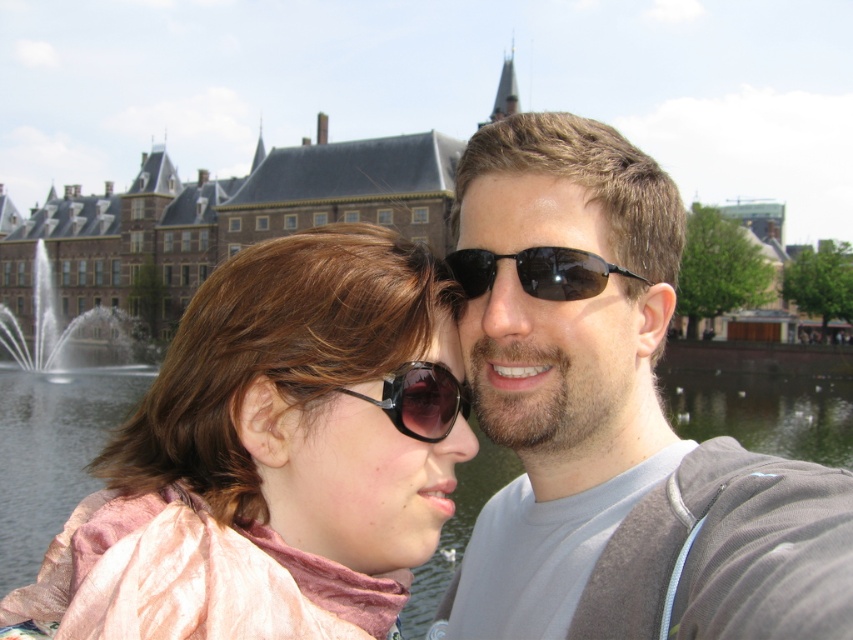
Who is taller, matte gray hoodie at center or pink fabric scarf at center?

With more height is matte gray hoodie at center.

Which is in front, point (753, 532) or point (283, 493)?

Positioned in front is point (753, 532).

Image resolution: width=853 pixels, height=640 pixels. In order to click on matte gray hoodie at center in this screenshot , I will do `click(613, 419)`.

From the picture: Between pink fabric scarf at center and sunglasses at center, which one has less height?

sunglasses at center

Is pink fabric scarf at center smaller than sunglasses at center?

Incorrect, pink fabric scarf at center is not smaller in size than sunglasses at center.

Is point (315, 381) more distant than point (405, 362)?

No, it is not.

You are a GUI agent. You are given a task and a screenshot of the screen. Output one action in this format:
    pyautogui.click(x=<x>, y=<y>)
    Task: Click on the pink fabric scarf at center
    The width and height of the screenshot is (853, 640).
    Given the screenshot: What is the action you would take?
    pyautogui.click(x=296, y=422)

Does silver metallic fountain at center have a greater width compared to black reflective sunglasses at center?

Yes, silver metallic fountain at center is wider than black reflective sunglasses at center.

Between silver metallic fountain at center and black reflective sunglasses at center, which one appears on the left side from the viewer's perspective?

silver metallic fountain at center

What are the coordinates of `silver metallic fountain at center` in the screenshot? It's located at (59, 324).

You are a GUI agent. You are given a task and a screenshot of the screen. Output one action in this format:
    pyautogui.click(x=<x>, y=<y>)
    Task: Click on the silver metallic fountain at center
    
    Given the screenshot: What is the action you would take?
    pyautogui.click(x=59, y=324)